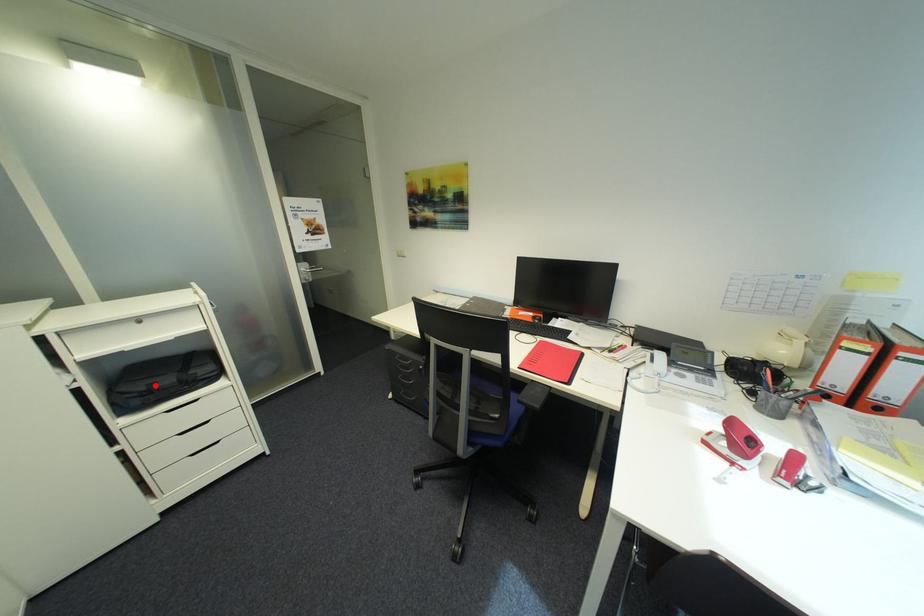
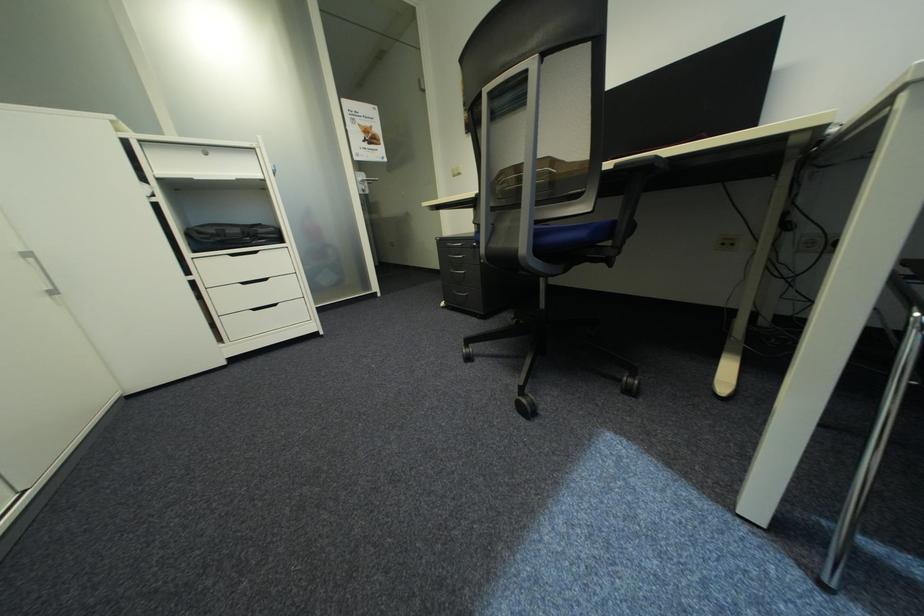
In the second image, find the point that corresponds to the highlighted location in the first image.

(225, 230)